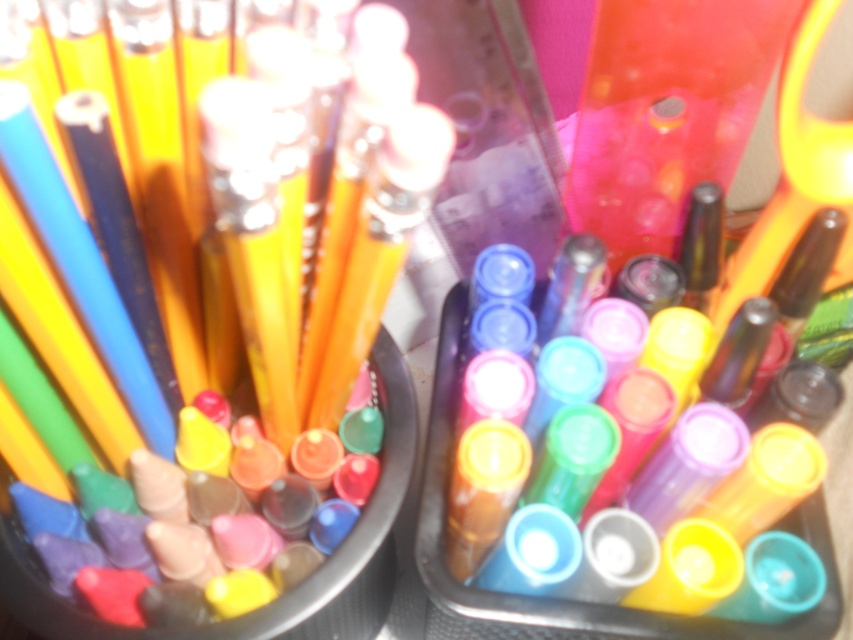
Question: Is yellow plastic scissors at upper right smaller than translucent plastic markers at center?

Choices:
 (A) no
 (B) yes

Answer: (A)

Question: Is yellow plastic scissors at upper right positioned in front of translucent plastic markers at center?

Choices:
 (A) yes
 (B) no

Answer: (A)

Question: Which object is closer to the camera taking this photo?

Choices:
 (A) yellow plastic scissors at upper right
 (B) translucent plastic markers at center
 (C) matte yellow pencil at center

Answer: (C)

Question: Which is farther from the yellow plastic scissors at upper right?

Choices:
 (A) translucent plastic markers at center
 (B) matte yellow pencil at center

Answer: (B)

Question: Can you confirm if yellow plastic scissors at upper right is positioned below matte yellow pencil at center?

Choices:
 (A) yes
 (B) no

Answer: (B)

Question: Which object is positioned closest to the translucent plastic markers at center?

Choices:
 (A) yellow plastic scissors at upper right
 (B) matte yellow pencil at center

Answer: (B)